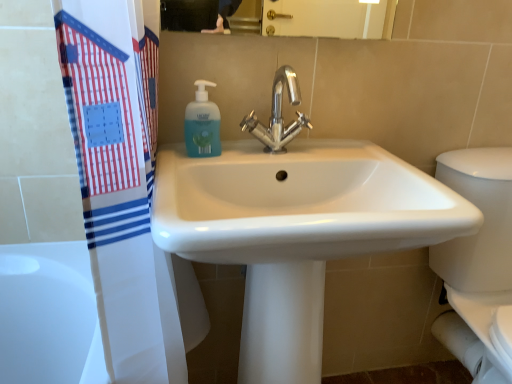
Question: Does translucent plastic soap dispenser at upper center have a smaller size compared to white glossy sink at center?

Choices:
 (A) no
 (B) yes

Answer: (B)

Question: Is translucent plastic soap dispenser at upper center located outside white glossy sink at center?

Choices:
 (A) yes
 (B) no

Answer: (A)

Question: From a real-world perspective, is translucent plastic soap dispenser at upper center over white glossy sink at center?

Choices:
 (A) no
 (B) yes

Answer: (B)

Question: Is translucent plastic soap dispenser at upper center to the left of white glossy sink at center from the viewer's perspective?

Choices:
 (A) yes
 (B) no

Answer: (A)

Question: From a real-world perspective, does translucent plastic soap dispenser at upper center sit lower than white glossy sink at center?

Choices:
 (A) no
 (B) yes

Answer: (A)

Question: Is translucent plastic soap dispenser at upper center positioned with its back to white glossy sink at center?

Choices:
 (A) yes
 (B) no

Answer: (B)

Question: Can you confirm if white glossy porcelain at right is smaller than white glossy sink at center?

Choices:
 (A) no
 (B) yes

Answer: (B)

Question: Does white glossy porcelain at right have a larger size compared to white glossy sink at center?

Choices:
 (A) no
 (B) yes

Answer: (A)

Question: Considering the relative positions of white glossy porcelain at right and white glossy sink at center in the image provided, is white glossy porcelain at right to the right of white glossy sink at center from the viewer's perspective?

Choices:
 (A) no
 (B) yes

Answer: (B)

Question: Is white glossy porcelain at right wider than white glossy sink at center?

Choices:
 (A) no
 (B) yes

Answer: (A)

Question: Is white glossy sink at center inside white glossy porcelain at right?

Choices:
 (A) no
 (B) yes

Answer: (A)

Question: Would you say white glossy porcelain at right is a long distance from white glossy sink at center?

Choices:
 (A) no
 (B) yes

Answer: (A)

Question: Can you confirm if polished chrome faucet at center is positioned to the left of white glossy sink at center?

Choices:
 (A) yes
 (B) no

Answer: (B)